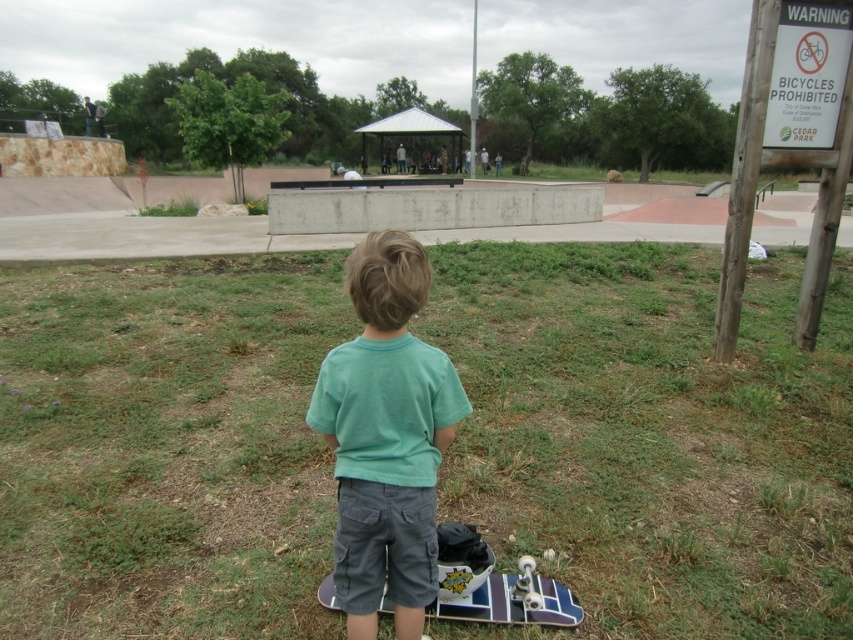
Is green grass at lower center taller than green cotton shirt at center?

Indeed, green grass at lower center has a greater height compared to green cotton shirt at center.

Who is positioned more to the left, green grass at lower center or green cotton shirt at center?

green cotton shirt at center is more to the left.

Which is behind, point (492, 252) or point (415, 376)?

The point (492, 252) is behind.

The height and width of the screenshot is (640, 853). What are the coordinates of `green grass at lower center` in the screenshot? It's located at (651, 435).